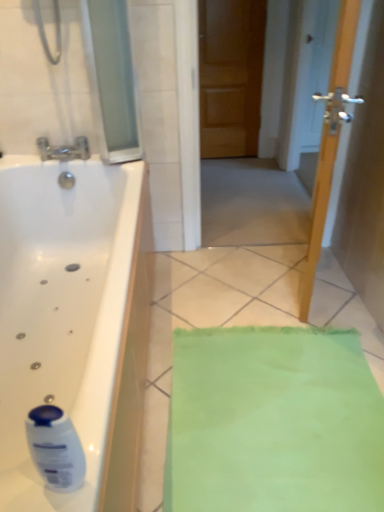
Image resolution: width=384 pixels, height=512 pixels. Describe the element at coordinates (64, 150) in the screenshot. I see `silver metallic faucet at upper left` at that location.

Measure the distance between point (49,446) and camera.

23.78 inches.

Where is `transparent glass door at upper left`? transparent glass door at upper left is located at coordinates (111, 78).

Image resolution: width=384 pixels, height=512 pixels. I want to click on wooden door at center, so click(x=296, y=77).

Would you say wooden door at center is inside or outside silver metallic faucet at upper left?

wooden door at center lies outside silver metallic faucet at upper left.

Where is `tap on the left of the wooden door at center`? The image size is (384, 512). tap on the left of the wooden door at center is located at coordinates (64, 150).

Is point (293, 194) closer to viewer compared to point (54, 152)?

No, (293, 194) is further to viewer.

Which is in front, wooden door at center or white glossy bottle at lower left?

white glossy bottle at lower left.

Looking at this image, does wooden door at center have a greater height compared to white glossy bottle at lower left?

Yes, wooden door at center is taller than white glossy bottle at lower left.

Is there a large distance between wooden door at center and white glossy bottle at lower left?

Absolutely, wooden door at center is distant from white glossy bottle at lower left.

Would you consider wooden door at center to be distant from wooden door at center?

Actually, wooden door at center and wooden door at center are a little close together.

Looking at the image, does wooden door at center seem bigger or smaller compared to wooden door at center?

Considering their sizes, wooden door at center takes up more space than wooden door at center.

Which is correct: wooden door at center is inside wooden door at center, or outside of it?

The correct answer is: outside.

Looking at this image, how distant is silver metallic faucet at upper left from transparent glass door at upper left?

silver metallic faucet at upper left is 12.35 inches away from transparent glass door at upper left.

This screenshot has height=512, width=384. What are the coordinates of `tap located underneath the transparent glass door at upper left (from a real-world perspective)` in the screenshot? It's located at (64, 150).

From a real-world perspective, is silver metallic faucet at upper left positioned above or below transparent glass door at upper left?

In terms of real-world spatial position, silver metallic faucet at upper left is below transparent glass door at upper left.

Could transparent glass door at upper left be considered to be inside silver metallic faucet at upper left?

No, transparent glass door at upper left is located outside of silver metallic faucet at upper left.

Between wooden door at center and white glossy bottle at lower left, which one has smaller width?

With smaller width is wooden door at center.

Which of these two, wooden door at center or white glossy bottle at lower left, is bigger?

With larger size is wooden door at center.

Is white glossy bottle at lower left at the back of wooden door at center?

No, wooden door at center is not facing the opposite direction of white glossy bottle at lower left.

Does point (250, 84) come in front of point (37, 445)?

No.

Is transparent glass door at upper left to the left of white glossy bottle at lower left from the viewer's perspective?

Correct, you'll find transparent glass door at upper left to the left of white glossy bottle at lower left.

From a real-world perspective, is transparent glass door at upper left physically below white glossy bottle at lower left?

No, from a real-world perspective, transparent glass door at upper left is not below white glossy bottle at lower left.

This screenshot has width=384, height=512. I want to click on cleaning product that appears below the transparent glass door at upper left (from the image's perspective), so click(55, 448).

Does transparent glass door at upper left have a lesser width compared to white glossy bottle at lower left?

No, transparent glass door at upper left is not thinner than white glossy bottle at lower left.

Is transparent glass door at upper left in front of or behind silver metallic faucet at upper left in the image?

Clearly, transparent glass door at upper left is in front of silver metallic faucet at upper left.

Between transparent glass door at upper left and silver metallic faucet at upper left, which one has more height?

transparent glass door at upper left.

Are transparent glass door at upper left and silver metallic faucet at upper left far apart?

They are positioned close to each other.

From the image's perspective, would you say transparent glass door at upper left is shown under silver metallic faucet at upper left?

Incorrect, from the image's perspective, transparent glass door at upper left is higher than silver metallic faucet at upper left.

The width and height of the screenshot is (384, 512). In order to click on tap above the wooden door at center (from a real-world perspective) in this screenshot , I will do `click(64, 150)`.

Identify the location of screen door that is under the white glossy bottle at lower left (from a real-world perspective). (296, 77).

From the image, which object appears to be nearer to transparent glass door at upper left, wooden door at center or wooden door at center?

wooden door at center is positioned closer to the anchor transparent glass door at upper left.

When comparing their distances from wooden door at center, does silver metallic faucet at upper left or white glossy bottle at lower left seem closer?

silver metallic faucet at upper left is positioned closer to the anchor wooden door at center.

Looking at this image, from the image, which object appears to be nearer to transparent glass door at upper left, wooden door at center or white glossy bottle at lower left?

white glossy bottle at lower left is closer to transparent glass door at upper left.

Based on their spatial positions, is transparent glass door at upper left or silver metallic faucet at upper left closer to wooden door at center?

transparent glass door at upper left is positioned closer to the anchor wooden door at center.

Estimate the real-world distances between objects in this image. Which object is further from transparent glass door at upper left, wooden door at center or silver metallic faucet at upper left?

The object further to transparent glass door at upper left is wooden door at center.

Looking at the image, which one is located closer to transparent glass door at upper left, white glossy bottle at lower left or wooden door at center?

Based on the image, white glossy bottle at lower left appears to be nearer to transparent glass door at upper left.

Which object lies nearer to the anchor point transparent glass door at upper left, silver metallic faucet at upper left or wooden door at center?

silver metallic faucet at upper left lies closer to transparent glass door at upper left than the other object.

Considering their positions, is wooden door at center positioned further to wooden door at center than transparent glass door at upper left?

transparent glass door at upper left is further to wooden door at center.

Locate an element on the screen. Image resolution: width=384 pixels, height=512 pixels. glass door located between white glossy bottle at lower left and wooden door at center in the depth direction is located at coordinates (111, 78).

This screenshot has width=384, height=512. Find the location of `screen door positioned between transparent glass door at upper left and wooden door at center from near to far`. screen door positioned between transparent glass door at upper left and wooden door at center from near to far is located at coordinates (296, 77).

The width and height of the screenshot is (384, 512). Identify the location of glass door located between white glossy bottle at lower left and silver metallic faucet at upper left in the depth direction. (111, 78).

Locate an element on the screen. screen door located between white glossy bottle at lower left and wooden door at center in the depth direction is located at coordinates (296, 77).